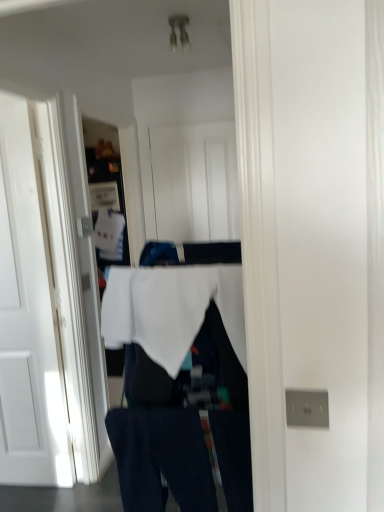
Question: Is white wood door at center, positioned as the 2th door in left-to-right order, located outside white fabric at center?

Choices:
 (A) no
 (B) yes

Answer: (B)

Question: Is white wood door at center, the first door in the right-to-left sequence, behind white fabric at center?

Choices:
 (A) no
 (B) yes

Answer: (B)

Question: Can you confirm if white wood door at center, which appears as the second door when viewed from the front, is positioned to the left of white fabric at center?

Choices:
 (A) yes
 (B) no

Answer: (A)

Question: Can you confirm if white wood door at center, which ranks as the first door in back-to-front order, is bigger than white fabric at center?

Choices:
 (A) yes
 (B) no

Answer: (B)

Question: Does white wood door at center, positioned as the 2th door in left-to-right order, appear on the right side of white fabric at center?

Choices:
 (A) no
 (B) yes

Answer: (A)

Question: Is white wood door at center, which ranks as the first door in back-to-front order, surrounding white fabric at center?

Choices:
 (A) no
 (B) yes

Answer: (A)

Question: From a real-world perspective, is dark blue denim jeans at lower center on top of white fabric at center?

Choices:
 (A) no
 (B) yes

Answer: (B)

Question: Is dark blue denim jeans at lower center completely or partially outside of white fabric at center?

Choices:
 (A) no
 (B) yes

Answer: (A)

Question: Considering the relative sizes of dark blue denim jeans at lower center and white fabric at center in the image provided, is dark blue denim jeans at lower center bigger than white fabric at center?

Choices:
 (A) yes
 (B) no

Answer: (B)

Question: Is dark blue denim jeans at lower center placed right next to white fabric at center?

Choices:
 (A) no
 (B) yes

Answer: (B)

Question: Is dark blue denim jeans at lower center positioned with its back to white fabric at center?

Choices:
 (A) no
 (B) yes

Answer: (B)

Question: Is the depth of dark blue denim jeans at lower center greater than that of white fabric at center?

Choices:
 (A) no
 (B) yes

Answer: (B)

Question: Considering the relative sizes of white matte door at left, the first door positioned from the left, and white fabric at center in the image provided, is white matte door at left, the first door positioned from the left, wider than white fabric at center?

Choices:
 (A) no
 (B) yes

Answer: (A)